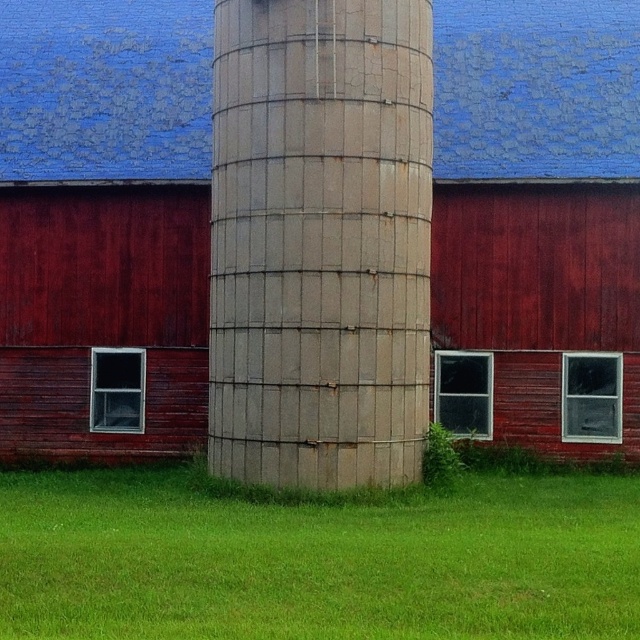
You are standing in front of the red barn and see the rusty metal water tower at center marked by point (320, 241). If you want to walk directly to the point where the tower is located, which direction should you head?

You should head towards the center of the image where the rusty metal water tower at center is located, as indicated by the point (320, 241).

You are standing on the green grass at lower center and want to reach the rusty metal water tower at center. Which direction should you move to get closer to the tower?

You should move upward towards the rusty metal water tower at center since it is located above the green grass at lower center.

You are standing in front of the red barn with a blue roof and looking at the cylindrical silo. There are two points marked on the silo at coordinates point (x=332, y=273) and point (x=358, y=577). Which point is closer to you?

Point (x=332, y=273) is further to the camera than point (x=358, y=577), so the point closer to you is point (x=358, y=577).